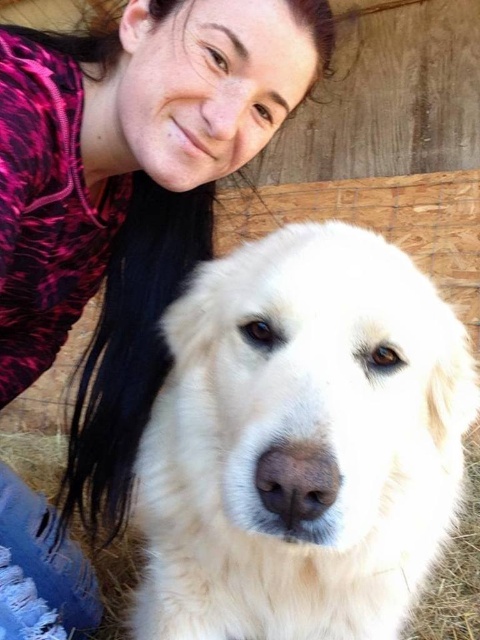
From the picture: Based on the scene description, where is the white fluffy dog at center located in the frame?

The white fluffy dog at center is located at point 0.692 on the x axis and 0.629 on the y axis.

Consider the image. You are trying to decide whether to place a small decorative item between the white fluffy dog at center and the pink printed hoodie at upper left. Based on their positions, which direction should you place the item so it is between them?

The white fluffy dog at center is positioned under the pink printed hoodie at upper left, so placing the item between them would require positioning it below the pink printed hoodie at upper left and above the white fluffy dog at center.

You are designing a poster and want to highlight both the white fluffy dog at center and the pink printed hoodie at upper left. Considering their sizes in the image, which one should you enlarge more to maintain their original proportions?

The white fluffy dog at center occupies less space than the pink printed hoodie at upper left, so you should enlarge the white fluffy dog at center more to maintain their original proportions.